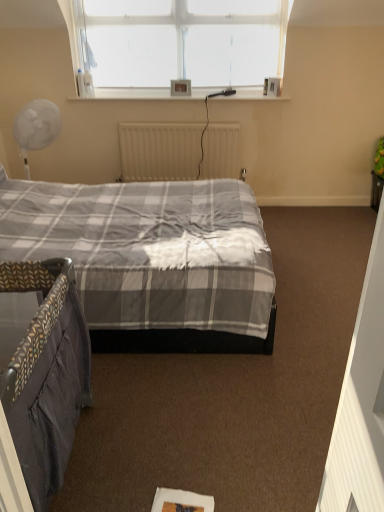
Question: Is point (183, 94) positioned closer to the camera than point (43, 421)?

Choices:
 (A) closer
 (B) farther

Answer: (B)

Question: From the image's perspective, relative to dark grey fabric crib at lower left, is matte plastic picture frame at upper center above or below?

Choices:
 (A) above
 (B) below

Answer: (A)

Question: Based on their relative distances, which object is farther from the matte plastic picture frame at upper center?

Choices:
 (A) dark grey fabric crib at lower left
 (B) white matte radiator at center

Answer: (A)

Question: Considering the real-world distances, which object is farthest from the white matte radiator at center?

Choices:
 (A) dark grey fabric crib at lower left
 (B) matte plastic picture frame at upper center

Answer: (A)